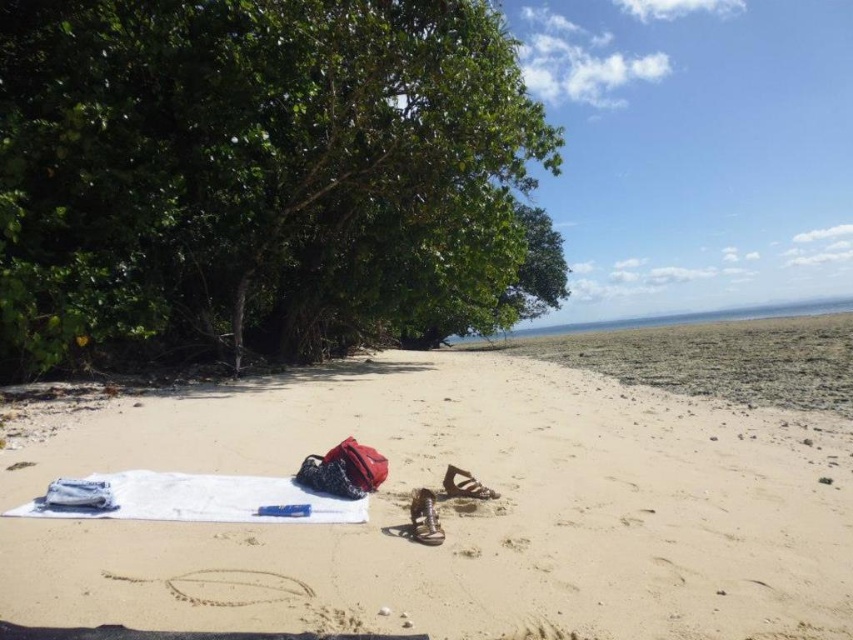
Does white sand at center have a lesser height compared to white cotton towel at lower left?

Incorrect, white sand at center's height does not fall short of white cotton towel at lower left's.

Who is more distant from viewer, [700,628] or [347,500]?

Point [347,500]

Describe the element at coordinates (461, 509) in the screenshot. Image resolution: width=853 pixels, height=640 pixels. I see `white sand at center` at that location.

What are the coordinates of `white sand at center` in the screenshot? It's located at (461, 509).

Can you confirm if green leafy tree at left is bigger than white cotton towel at lower left?

Indeed, green leafy tree at left has a larger size compared to white cotton towel at lower left.

Who is taller, green leafy tree at left or white cotton towel at lower left?

Standing taller between the two is green leafy tree at left.

Does point (376, 92) lie behind point (30, 509)?

Yes, it is.

At what (x,y) coordinates should I click in order to perform the action: click on green leafy tree at left. Please return your answer as a coordinate pair (x, y). This screenshot has width=853, height=640. Looking at the image, I should click on (263, 179).

Does white sand at center appear on the left side of green leafy tree at left?

In fact, white sand at center is to the right of green leafy tree at left.

Between white sand at center and green leafy tree at left, which one has more height?

With more height is green leafy tree at left.

Does point (190, 456) come behind point (111, 74)?

No, (190, 456) is closer to viewer.

The height and width of the screenshot is (640, 853). I want to click on white sand at center, so click(461, 509).